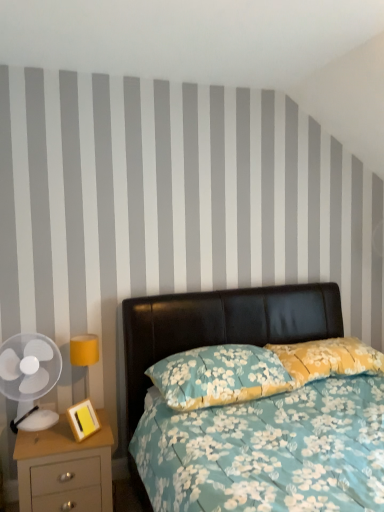
Image resolution: width=384 pixels, height=512 pixels. Identify the location of vacant region in front of transparent plastic fan at left. (33, 436).